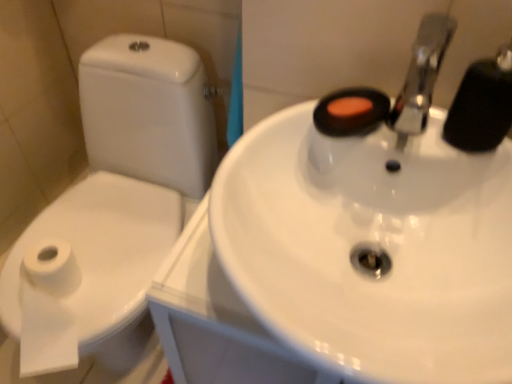
What do you see at coordinates (482, 104) in the screenshot? This screenshot has height=384, width=512. I see `black rubber faucet at upper right` at bounding box center [482, 104].

This screenshot has width=512, height=384. Describe the element at coordinates (103, 261) in the screenshot. I see `white paper bidet at left` at that location.

This screenshot has width=512, height=384. I want to click on black rubber faucet at upper right, so click(x=482, y=104).

Is white paper bidet at left positioned behind black rubber faucet at upper right?

That is True.

The height and width of the screenshot is (384, 512). I want to click on plumbing fixture above the white paper bidet at left (from a real-world perspective), so click(482, 104).

Between white paper bidet at left and black rubber faucet at upper right, which one appears on the right side from the viewer's perspective?

Positioned to the right is black rubber faucet at upper right.

Considering the sizes of objects white paper bidet at left and black rubber faucet at upper right in the image provided, who is taller, white paper bidet at left or black rubber faucet at upper right?

Standing taller between the two is black rubber faucet at upper right.

Does white paper bidet at left have a greater height compared to white glossy sink at center?

No, white paper bidet at left is not taller than white glossy sink at center.

Does white paper bidet at left have a lesser width compared to white glossy sink at center?

Correct, the width of white paper bidet at left is less than that of white glossy sink at center.

Is white paper bidet at left facing away from white glossy sink at center?

No, white paper bidet at left is not facing the opposite direction of white glossy sink at center.

From a real-world perspective, which is physically below, white paper bidet at left or white glossy sink at center?

In real-world perspective, white paper bidet at left is lower.

From a real-world perspective, which is physically below, white glossy sink at center or white paper bidet at left?

In real-world perspective, white paper bidet at left is lower.

This screenshot has height=384, width=512. In order to click on bidet below the white glossy sink at center (from a real-world perspective) in this screenshot , I will do `click(103, 261)`.

Does white glossy sink at center have a greater width compared to white paper bidet at left?

Yes.

Does point (253, 246) appear closer or farther from the camera than point (101, 336)?

Point (253, 246) appears to be closer to the viewer than point (101, 336).

From a real-world perspective, who is located higher, black rubber faucet at upper right or white glossy sink at center?

From a 3D spatial view, black rubber faucet at upper right is above.

Is black rubber faucet at upper right far away from white glossy sink at center?

That's not correct — black rubber faucet at upper right is a little close to white glossy sink at center.

Who is shorter, black rubber faucet at upper right or white glossy sink at center?

Standing shorter between the two is black rubber faucet at upper right.

Is black rubber faucet at upper right positioned in front of white glossy sink at center?

That is False.

Can you confirm if white glossy sink at center is shorter than black rubber faucet at upper right?

No.

From a real-world perspective, is white glossy sink at center on top of black rubber faucet at upper right?

Incorrect, from a real-world perspective, white glossy sink at center is lower than black rubber faucet at upper right.

Which object is wider, white glossy sink at center or black rubber faucet at upper right?

white glossy sink at center is wider.

Can you confirm if white glossy sink at center is positioned to the left of black rubber faucet at upper right?

Indeed, white glossy sink at center is positioned on the left side of black rubber faucet at upper right.

Considering the relative positions of black rubber faucet at upper right and white paper bidet at left in the image provided, is black rubber faucet at upper right to the left of white paper bidet at left from the viewer's perspective?

No, black rubber faucet at upper right is not to the left of white paper bidet at left.

Considering the sizes of objects black rubber faucet at upper right and white paper bidet at left in the image provided, who is thinner, black rubber faucet at upper right or white paper bidet at left?

black rubber faucet at upper right is thinner.

You are a GUI agent. You are given a task and a screenshot of the screen. Output one action in this format:
    pyautogui.click(x=<x>, y=<y>)
    Task: Click on the bidet lying below the black rubber faucet at upper right (from the image's perspective)
    This screenshot has height=384, width=512.
    Given the screenshot: What is the action you would take?
    pyautogui.click(x=103, y=261)

Locate an element on the screen. bidet lying on the left of black rubber faucet at upper right is located at coordinates (103, 261).

In the image, there is a white glossy sink at center. In order to click on bidet below it (from the image's perspective) in this screenshot , I will do `click(103, 261)`.

Based on their spatial positions, is white glossy sink at center or white paper bidet at left further from black rubber faucet at upper right?

white paper bidet at left lies further to black rubber faucet at upper right than the other object.

From the image, which object appears to be farther from white glossy sink at center, black rubber faucet at upper right or white paper bidet at left?

white paper bidet at left is positioned further to the anchor white glossy sink at center.

Consider the image. Based on their spatial positions, is white paper bidet at left or white glossy sink at center closer to black rubber faucet at upper right?

Based on the image, white glossy sink at center appears to be nearer to black rubber faucet at upper right.

Estimate the real-world distances between objects in this image. Which object is closer to white paper bidet at left, white glossy sink at center or black rubber faucet at upper right?

Based on the image, white glossy sink at center appears to be nearer to white paper bidet at left.

When comparing their distances from white glossy sink at center, does white paper bidet at left or black rubber faucet at upper right seem closer?

The object closer to white glossy sink at center is black rubber faucet at upper right.

Based on their spatial positions, is black rubber faucet at upper right or white glossy sink at center further from white paper bidet at left?

black rubber faucet at upper right.

At what (x,y) coordinates should I click in order to perform the action: click on sink between white paper bidet at left and black rubber faucet at upper right. Please return your answer as a coordinate pair (x, y). This screenshot has width=512, height=384. Looking at the image, I should click on (381, 224).